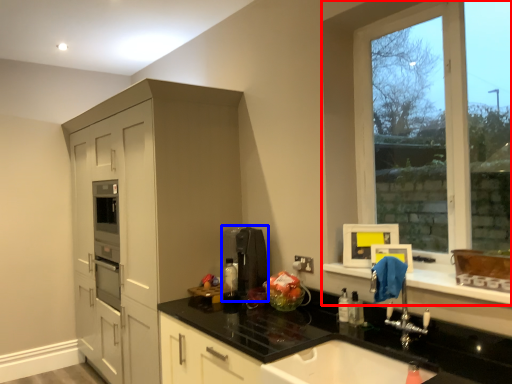
Question: Which object appears closest to the camera in this image, window (highlighted by a red box) or coffee machine (highlighted by a blue box)?

Choices:
 (A) window
 (B) coffee machine

Answer: (A)